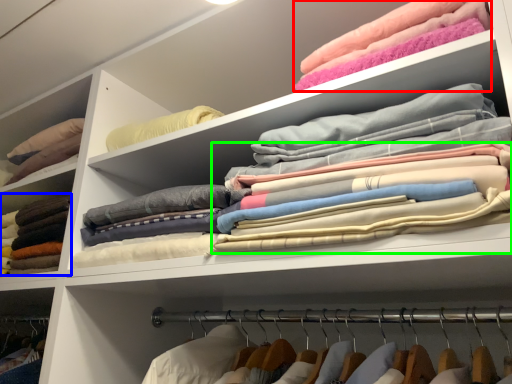
Question: Based on their relative distances, which object is farther from clothing (highlighted by a red box)? Choose from clothing (highlighted by a blue box) and clothing (highlighted by a green box).

Choices:
 (A) clothing
 (B) clothing

Answer: (A)